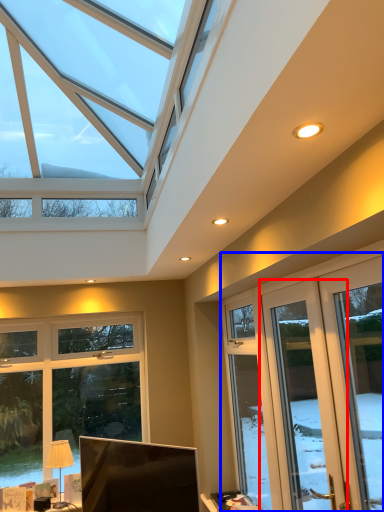
Question: Which point is further to the camera, screen door (highlighted by a red box) or screen door (highlighted by a blue box)?

Choices:
 (A) screen door
 (B) screen door

Answer: (A)